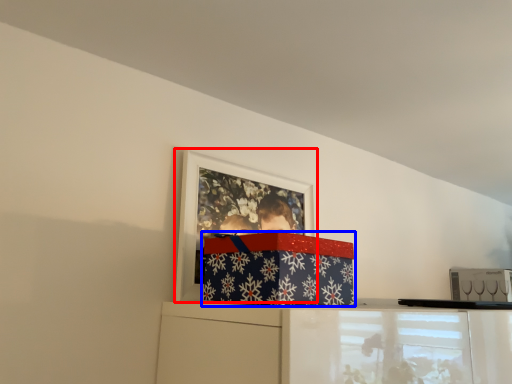
Question: Which point is further to the camera, picture frame (highlighted by a red box) or package (highlighted by a blue box)?

Choices:
 (A) picture frame
 (B) package

Answer: (A)